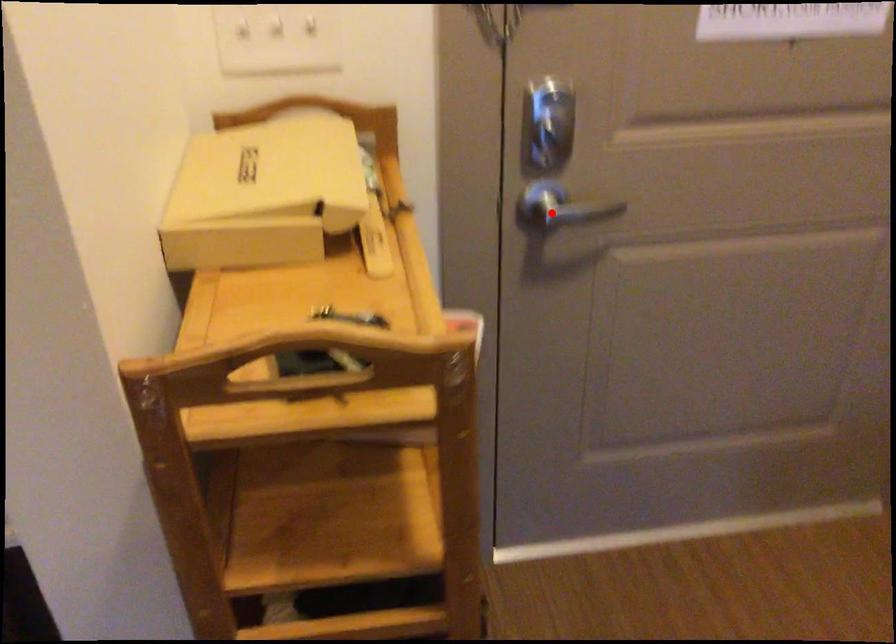
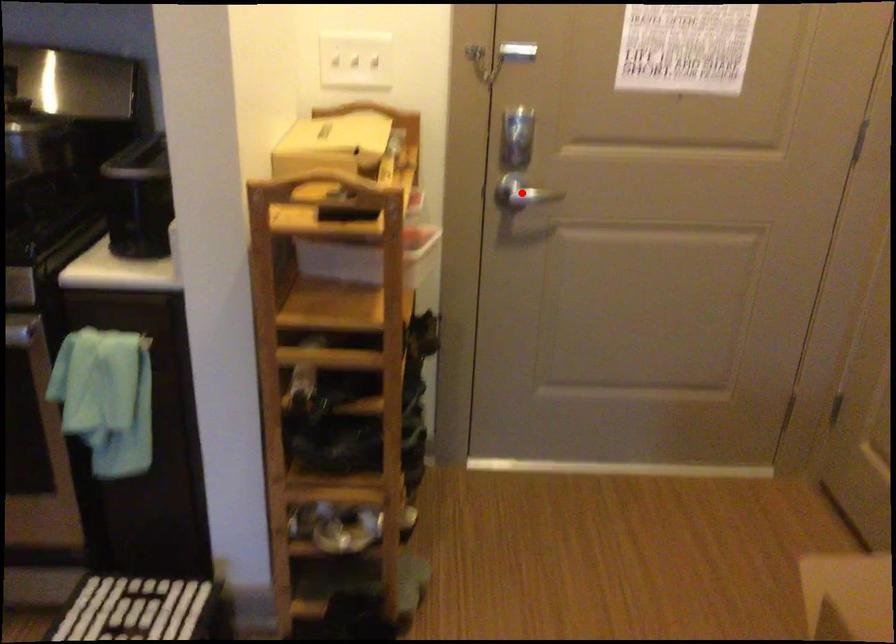
I am providing you with two images of the same scene from different viewpoints. A red point is marked on the first image and another point is marked on the second image. Do the highlighted points in image1 and image2 indicate the same real-world spot?

Yes